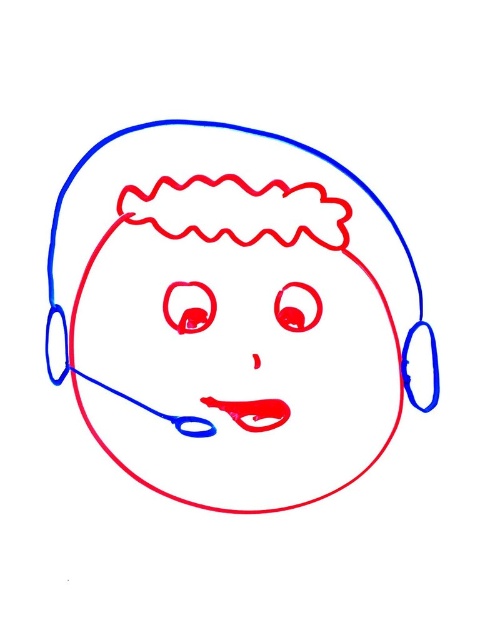
Does matte blue headset at center have a lesser height compared to rubber-like red mouth at center?

No.

At what (x,y) coordinates should I click in order to perform the action: click on matte blue headset at center. Please return your answer as a coordinate pair (x, y). This screenshot has width=480, height=640. Looking at the image, I should click on (212, 241).

Identify the location of matte blue headset at center. The height and width of the screenshot is (640, 480). (212, 241).